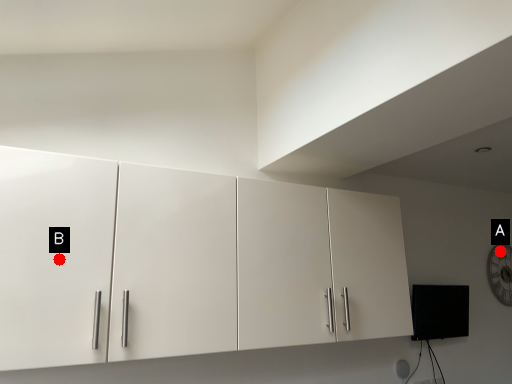
Question: Two points are circled on the image, labeled by A and B beside each circle. Which point is further to the camera?

Choices:
 (A) A is further
 (B) B is further

Answer: (A)